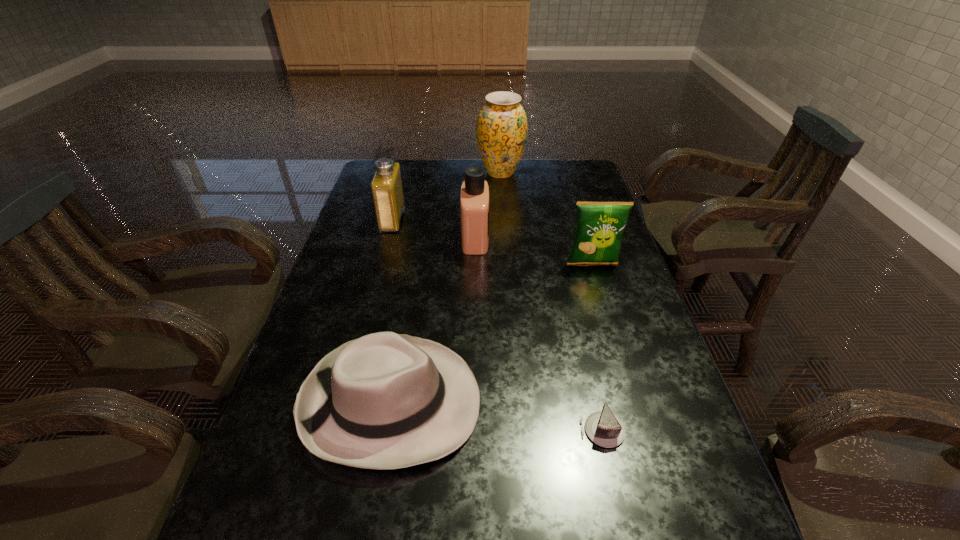
Identify the location of free space at the far left corner of the desktop. (412, 168).

I want to click on vacant space at the far right corner of the desktop, so coord(599,187).

At what (x,y) coordinates should I click in order to perform the action: click on free point between the third nearest object and the shortest object. Please return your answer as a coordinate pair (x, y). This screenshot has height=540, width=960. Looking at the image, I should click on (597, 347).

Find the location of a particular element. free space that is in between the left perfume and the right perfume is located at coordinates [x=434, y=229].

The image size is (960, 540). Find the location of `vacant area that lies between the crisp (potato chip) and the right perfume`. vacant area that lies between the crisp (potato chip) and the right perfume is located at coordinates (534, 251).

Find the location of a particular element. Image resolution: width=960 pixels, height=540 pixels. empty location between the chocolate cake and the fourth farthest object is located at coordinates (597, 347).

The width and height of the screenshot is (960, 540). I want to click on free space between the left perfume and the chocolate cake, so [497, 325].

The width and height of the screenshot is (960, 540). In order to click on free area in between the left perfume and the shortest object in this screenshot , I will do `click(497, 325)`.

Identify the location of vacant space in between the right perfume and the fedora. This screenshot has height=540, width=960. (433, 320).

The image size is (960, 540). I want to click on vacant space that's between the fifth tallest object and the chocolate cake, so click(496, 416).